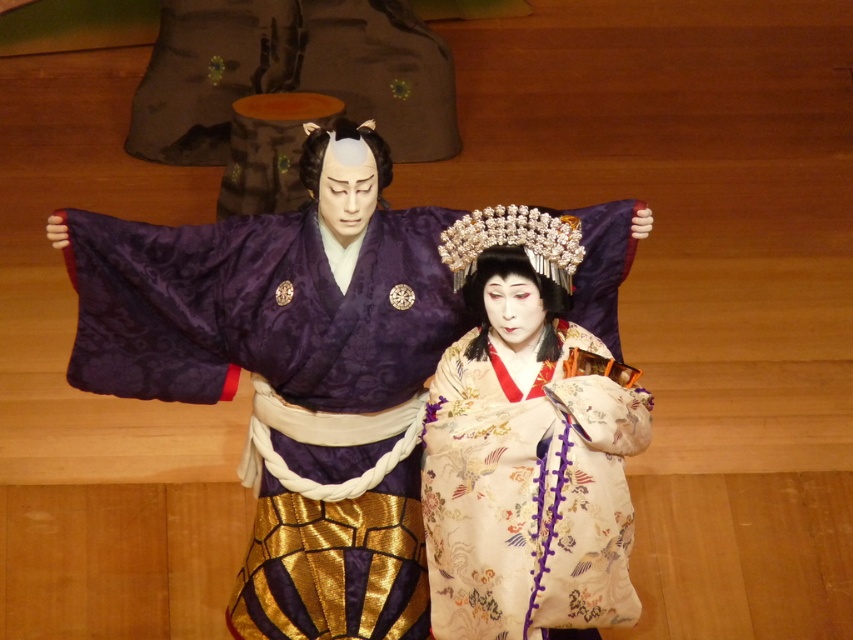
Question: Which object is closer to the camera taking this photo?

Choices:
 (A) silky beige kimono at center
 (B) silky purple kimono at center

Answer: (A)

Question: Does silky purple kimono at center appear on the right side of silky beige kimono at center?

Choices:
 (A) no
 (B) yes

Answer: (A)

Question: Observing the image, what is the correct spatial positioning of silky purple kimono at center in reference to silky beige kimono at center?

Choices:
 (A) left
 (B) right

Answer: (A)

Question: Which of the following is the closest to the observer?

Choices:
 (A) pyautogui.click(x=529, y=611)
 (B) pyautogui.click(x=338, y=486)

Answer: (A)

Question: Is silky purple kimono at center above silky beige kimono at center?

Choices:
 (A) yes
 (B) no

Answer: (A)